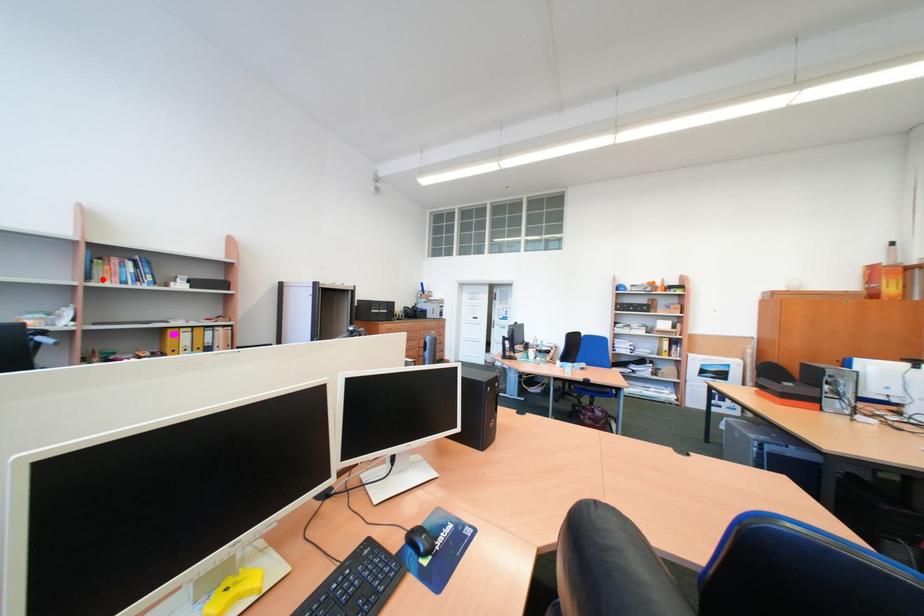
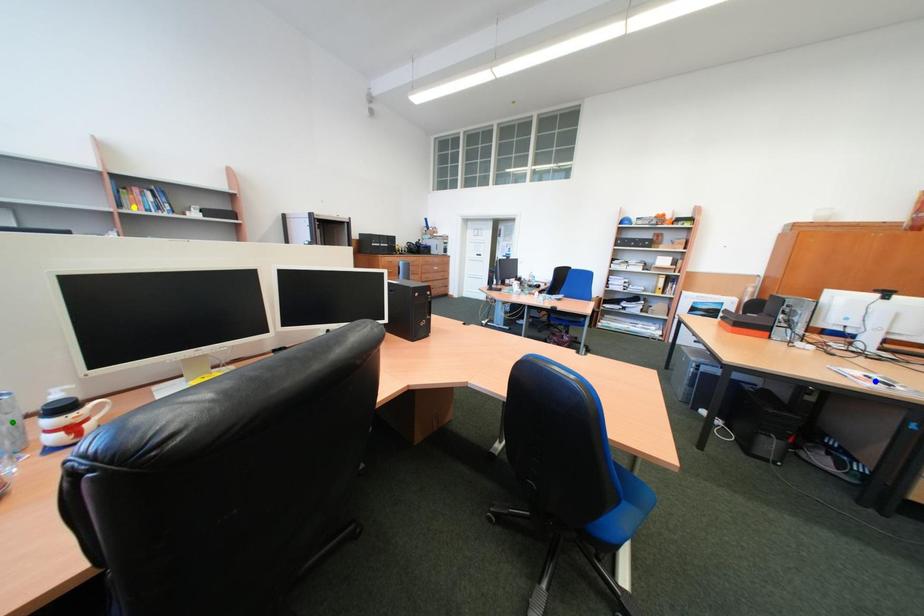
Question: I am providing you with two images of the same scene from different viewpoints. A red point is marked on the first image. You are given multiple points on the second image. Which point in image 2 represents the same 3d spot as the red point in image 1?

Choices:
 (A) blue point
 (B) yellow point
 (C) green point

Answer: (B)